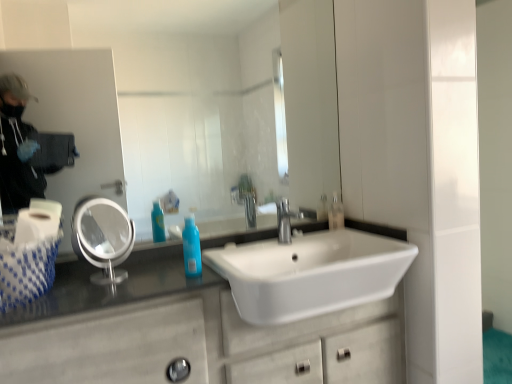
You are a GUI agent. You are given a task and a screenshot of the screen. Output one action in this format:
    pyautogui.click(x=<x>, y=<y>)
    Task: Click on the space that is in front of translucent plastic soap dispenser at upper right
    The width and height of the screenshot is (512, 384).
    Given the screenshot: What is the action you would take?
    pyautogui.click(x=342, y=231)